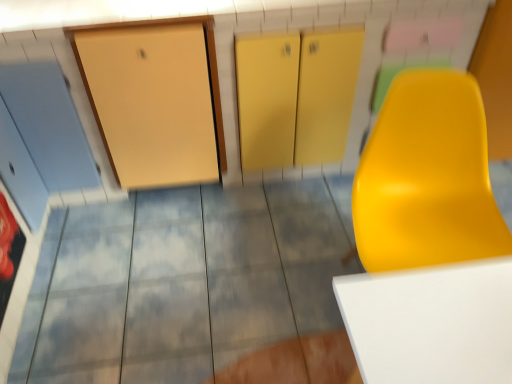
Question: Is matte yellow tile at center at the back of matte yellow chair at right?

Choices:
 (A) yes
 (B) no

Answer: (B)

Question: From a real-world perspective, is matte yellow chair at right physically below matte yellow tile at center?

Choices:
 (A) yes
 (B) no

Answer: (B)

Question: Does matte yellow chair at right have a larger size compared to matte yellow tile at center?

Choices:
 (A) no
 (B) yes

Answer: (A)

Question: Is the depth of matte yellow chair at right greater than that of matte yellow tile at center?

Choices:
 (A) no
 (B) yes

Answer: (A)

Question: Is matte yellow chair at right not close to matte yellow tile at center?

Choices:
 (A) yes
 (B) no

Answer: (B)

Question: Is matte yellow chair at right surrounding matte yellow tile at center?

Choices:
 (A) yes
 (B) no

Answer: (B)

Question: Can you see matte yellow tile at center touching matte yellow chair at right?

Choices:
 (A) no
 (B) yes

Answer: (A)

Question: From the image's perspective, would you say matte yellow tile at center is positioned over matte yellow chair at right?

Choices:
 (A) yes
 (B) no

Answer: (B)

Question: Is matte yellow chair at right a part of matte yellow tile at center?

Choices:
 (A) yes
 (B) no

Answer: (B)

Question: Is matte yellow tile at center facing towards matte yellow chair at right?

Choices:
 (A) no
 (B) yes

Answer: (A)

Question: Is matte yellow tile at center taller than matte yellow chair at right?

Choices:
 (A) yes
 (B) no

Answer: (B)

Question: Is matte yellow tile at center smaller than matte yellow chair at right?

Choices:
 (A) no
 (B) yes

Answer: (A)

Question: Is point (411, 115) positioned closer to the camera than point (326, 187)?

Choices:
 (A) closer
 (B) farther

Answer: (A)